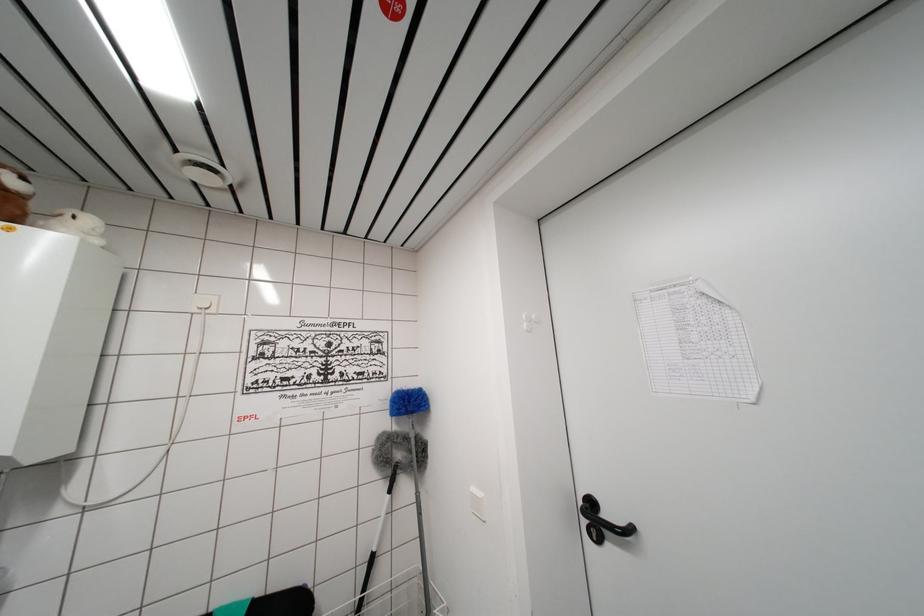
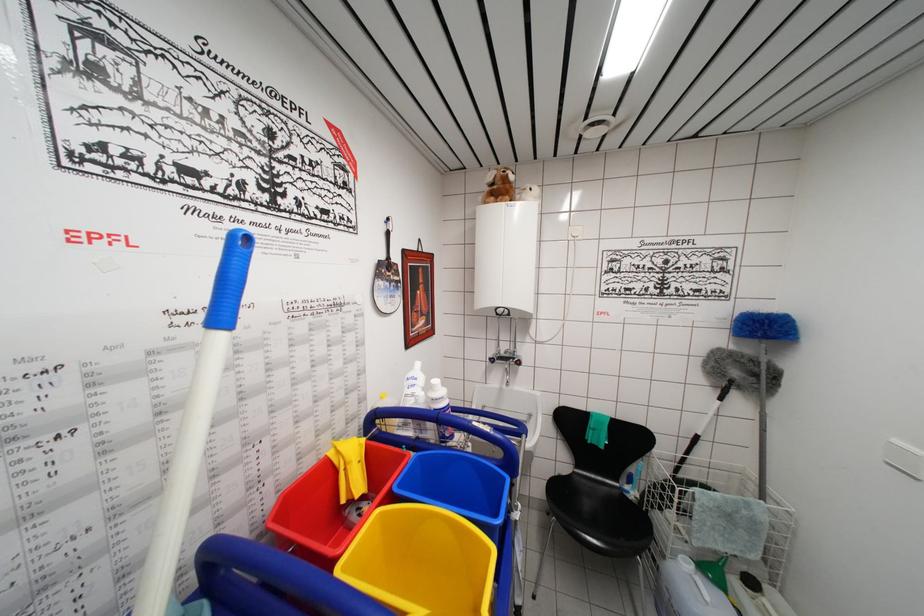
The first image is from the beginning of the video and the second image is from the end. How did the camera likely rotate when shooting the video?

The camera's rotation is toward left-down.